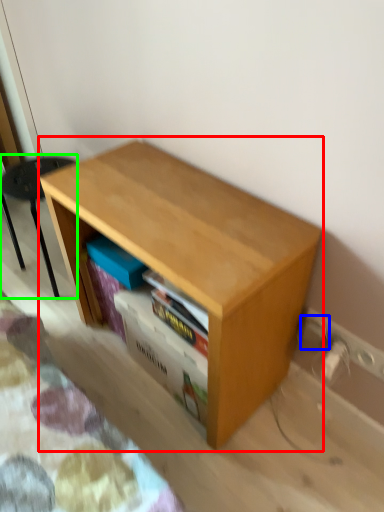
Question: Which is farther away from table (highlighted by a red box)? electric outlet (highlighted by a blue box) or furniture (highlighted by a green box)?

Choices:
 (A) electric outlet
 (B) furniture

Answer: (B)